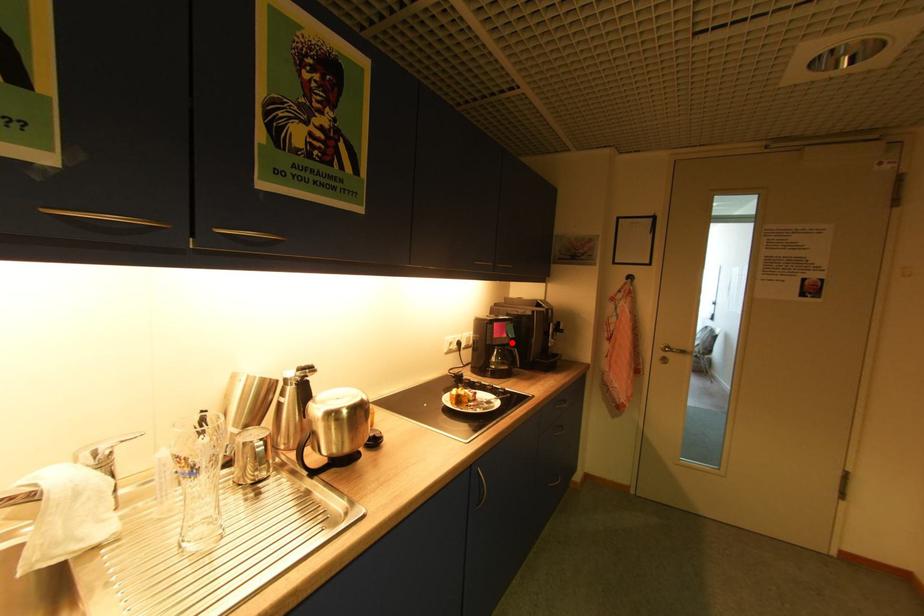
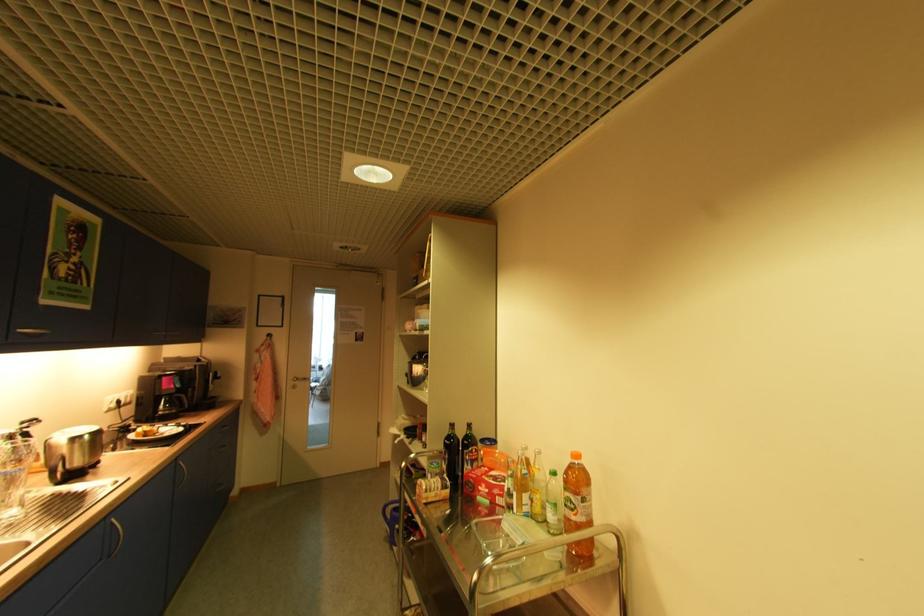
Question: I am providing you with two images of the same scene from different viewpoints. A red point is marked on the first image. At the location where the point appears in image 1, is it still visible in image 2?

Choices:
 (A) Yes
 (B) No

Answer: (A)